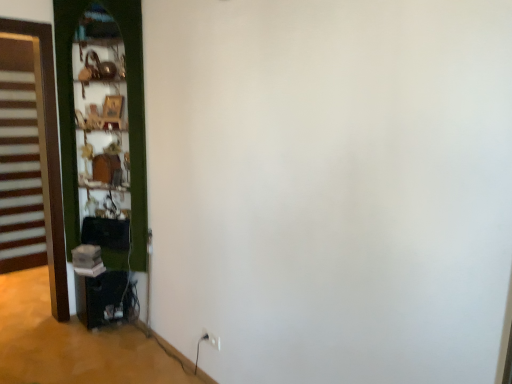
Question: Can you confirm if white plastic electric outlet at lower center is bigger than green wooden door at left, arranged as the 2th door when viewed from the left?

Choices:
 (A) yes
 (B) no

Answer: (B)

Question: Does white plastic electric outlet at lower center have a lesser height compared to green wooden door at left, acting as the 1th door starting from the right?

Choices:
 (A) yes
 (B) no

Answer: (A)

Question: Is white plastic electric outlet at lower center to the left of green wooden door at left, acting as the 1th door starting from the right, from the viewer's perspective?

Choices:
 (A) no
 (B) yes

Answer: (A)

Question: Is white plastic electric outlet at lower center to the right of green wooden door at left, arranged as the 2th door when viewed from the left, from the viewer's perspective?

Choices:
 (A) no
 (B) yes

Answer: (B)

Question: Is white plastic electric outlet at lower center next to green wooden door at left, acting as the 1th door starting from the right, and touching it?

Choices:
 (A) no
 (B) yes

Answer: (A)

Question: Choose the correct answer: Is green wooden door at left, arranged as the 2th door when viewed from the left, inside brown wooden door at left, positioned as the second door in right-to-left order, or outside it?

Choices:
 (A) inside
 (B) outside

Answer: (B)

Question: Is green wooden door at left, arranged as the 2th door when viewed from the left, taller or shorter than brown wooden door at left, positioned as the second door in right-to-left order?

Choices:
 (A) tall
 (B) short

Answer: (B)

Question: Would you say green wooden door at left, arranged as the 2th door when viewed from the left, is to the left or to the right of brown wooden door at left, positioned as the second door in right-to-left order, in the picture?

Choices:
 (A) left
 (B) right

Answer: (B)

Question: From the image's perspective, is green wooden door at left, arranged as the 2th door when viewed from the left, located above or below brown wooden door at left, the 1th door viewed from the left?

Choices:
 (A) below
 (B) above

Answer: (B)

Question: Is brown wooden door at left, the 1th door viewed from the left, in front of or behind white plastic electric outlet at lower center in the image?

Choices:
 (A) front
 (B) behind

Answer: (B)

Question: Is point (31, 142) closer or farther from the camera than point (212, 344)?

Choices:
 (A) closer
 (B) farther

Answer: (B)

Question: From the image's perspective, is brown wooden door at left, positioned as the second door in right-to-left order, located above or below white plastic electric outlet at lower center?

Choices:
 (A) below
 (B) above

Answer: (B)

Question: In terms of size, does brown wooden door at left, positioned as the second door in right-to-left order, appear bigger or smaller than white plastic electric outlet at lower center?

Choices:
 (A) small
 (B) big

Answer: (B)

Question: Is brown wooden door at left, the 1th door viewed from the left, inside or outside of green wooden door at left, arranged as the 2th door when viewed from the left?

Choices:
 (A) outside
 (B) inside

Answer: (A)

Question: In terms of size, does brown wooden door at left, the 1th door viewed from the left, appear bigger or smaller than green wooden door at left, arranged as the 2th door when viewed from the left?

Choices:
 (A) small
 (B) big

Answer: (A)